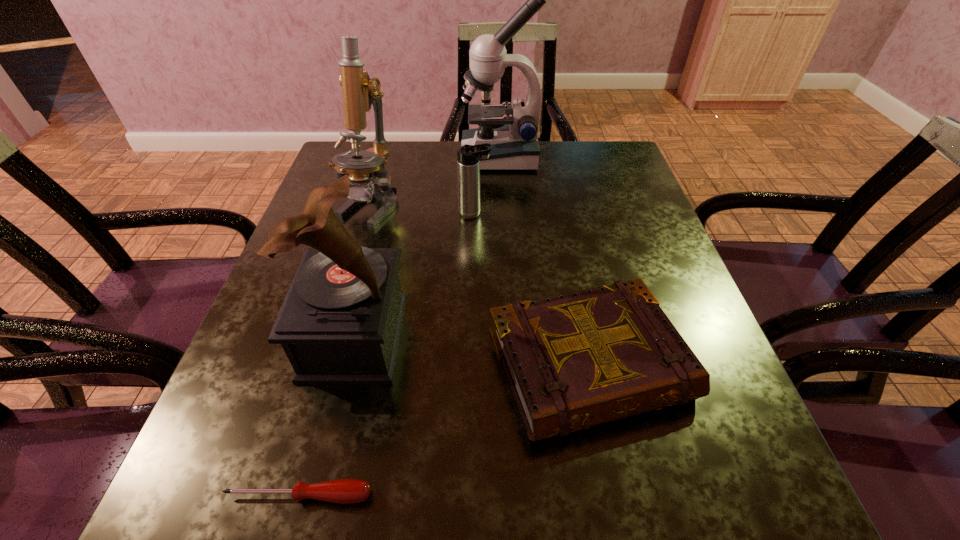
Locate an element on the screen. The height and width of the screenshot is (540, 960). vacant space in between the hardback book and the phonograph_record is located at coordinates 471,350.

Identify the location of free space between the left microscope and the thermos bottle. (421, 210).

What are the coordinates of `unoccupied position between the third tallest object and the fifth tallest object` in the screenshot? It's located at (471, 350).

The image size is (960, 540). What are the coordinates of `unoccupied position between the farthest object and the second shortest object` in the screenshot? It's located at (544, 261).

Find the location of `free space between the fourth shortest object and the hardback book`. free space between the fourth shortest object and the hardback book is located at coordinates click(471, 350).

Locate an element on the screen. The width and height of the screenshot is (960, 540). vacant space that's between the farther microscope and the fourth tallest object is located at coordinates (488, 185).

Where is `free point between the farthest object and the left microscope`? The height and width of the screenshot is (540, 960). free point between the farthest object and the left microscope is located at coordinates (434, 181).

Choose which object is the second nearest neighbor to the fourth tallest object. Please provide its 2D coordinates. Your answer should be formatted as a tuple, i.e. [(x, y)], where the tuple contains the x and y coordinates of a point satisfying the conditions above.

[(513, 133)]

Locate an element on the screen. object that is the closest one to the third tallest object is located at coordinates (343, 491).

Locate an element on the screen. The image size is (960, 540). vacant position in the image that satisfies the following two spatial constraints: 1. at the eyepiece of the right microscope; 2. on the left side of the fifth tallest object is located at coordinates (513, 366).